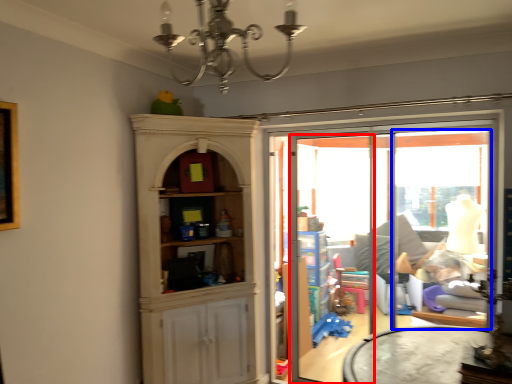
Question: Which point is further to the camera, screen door (highlighted by a red box) or window (highlighted by a blue box)?

Choices:
 (A) screen door
 (B) window

Answer: (A)